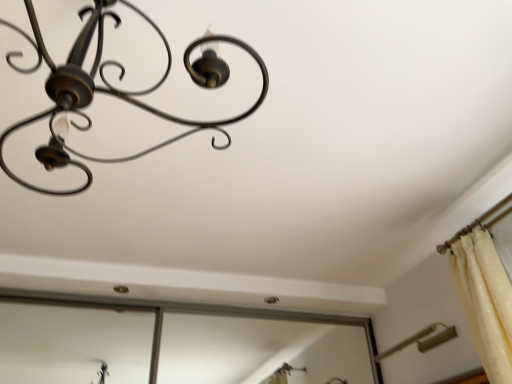
Question: In terms of width, does matte black chandelier at upper left, the first lamp viewed from the top, look wider or thinner when compared to metallic gold lamp at lower right, which is the second lamp from top to bottom?

Choices:
 (A) wide
 (B) thin

Answer: (A)

Question: Is point (99, 51) closer or farther from the camera than point (456, 336)?

Choices:
 (A) closer
 (B) farther

Answer: (A)

Question: Considering the positions of matte black chandelier at upper left, the 1th lamp viewed from the left, and metallic gold lamp at lower right, marked as the 2th lamp in a left-to-right arrangement, in the image, is matte black chandelier at upper left, the 1th lamp viewed from the left, bigger or smaller than metallic gold lamp at lower right, marked as the 2th lamp in a left-to-right arrangement,?

Choices:
 (A) small
 (B) big

Answer: (B)

Question: From the image's perspective, is metallic gold lamp at lower right, which is the second lamp from top to bottom, located above or below matte black chandelier at upper left, which appears as the second lamp when ordered from the bottom?

Choices:
 (A) below
 (B) above

Answer: (A)

Question: From their relative heights in the image, would you say metallic gold lamp at lower right, marked as the 2th lamp in a left-to-right arrangement, is taller or shorter than matte black chandelier at upper left, the first lamp viewed from the top?

Choices:
 (A) tall
 (B) short

Answer: (B)

Question: From a real-world perspective, is metallic gold lamp at lower right, acting as the 1th lamp starting from the right, above or below matte black chandelier at upper left, which ranks as the first lamp in front-to-back order?

Choices:
 (A) above
 (B) below

Answer: (B)

Question: Is metallic gold lamp at lower right, which is the first lamp from bottom to top, inside the boundaries of matte black chandelier at upper left, which is the 2th lamp in back-to-front order, or outside?

Choices:
 (A) inside
 (B) outside

Answer: (B)